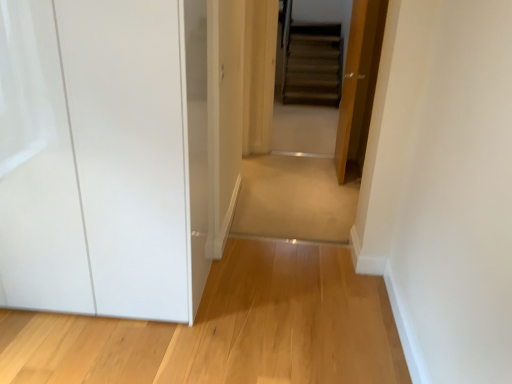
Question: Is transparent glossy cabinet at left to the right of wooden door at center from the viewer's perspective?

Choices:
 (A) yes
 (B) no

Answer: (B)

Question: Is transparent glossy cabinet at left touching wooden door at center?

Choices:
 (A) no
 (B) yes

Answer: (A)

Question: Is wooden door at center inside transparent glossy cabinet at left?

Choices:
 (A) no
 (B) yes

Answer: (A)

Question: Is transparent glossy cabinet at left thinner than wooden door at center?

Choices:
 (A) no
 (B) yes

Answer: (A)

Question: From a real-world perspective, is transparent glossy cabinet at left on top of wooden door at center?

Choices:
 (A) yes
 (B) no

Answer: (B)

Question: Considering the relative sizes of transparent glossy cabinet at left and wooden door at center in the image provided, is transparent glossy cabinet at left smaller than wooden door at center?

Choices:
 (A) no
 (B) yes

Answer: (A)

Question: Considering the relative sizes of light wood floor at lower left, the second path viewed from the top, and wooden door at center in the image provided, is light wood floor at lower left, the second path viewed from the top, taller than wooden door at center?

Choices:
 (A) no
 (B) yes

Answer: (A)

Question: Is light wood floor at lower left, acting as the first path starting from the bottom, completely or partially outside of wooden door at center?

Choices:
 (A) no
 (B) yes

Answer: (B)

Question: Is light wood floor at lower left, the second path viewed from the top, oriented away from wooden door at center?

Choices:
 (A) yes
 (B) no

Answer: (B)

Question: Is wooden door at center a part of light wood floor at lower left, acting as the first path starting from the bottom?

Choices:
 (A) no
 (B) yes

Answer: (A)

Question: Is light wood floor at lower left, acting as the first path starting from the bottom, facing towards wooden door at center?

Choices:
 (A) no
 (B) yes

Answer: (A)

Question: Can you confirm if light wood floor at lower left, which is the second path in back-to-front order, is thinner than wooden door at center?

Choices:
 (A) yes
 (B) no

Answer: (B)

Question: Is light wood floor at lower left, which is the second path in back-to-front order, positioned beyond the bounds of transparent glossy cabinet at left?

Choices:
 (A) no
 (B) yes

Answer: (B)